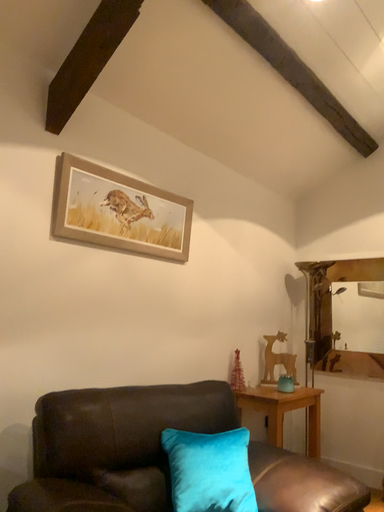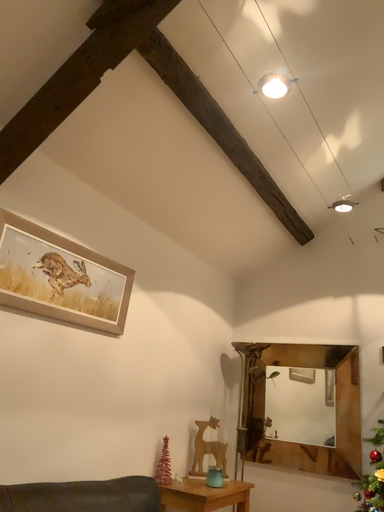
Question: Which way did the camera rotate in the video?

Choices:
 (A) rotated left
 (B) rotated right

Answer: (B)